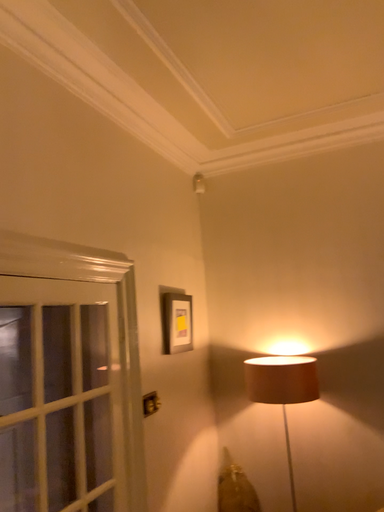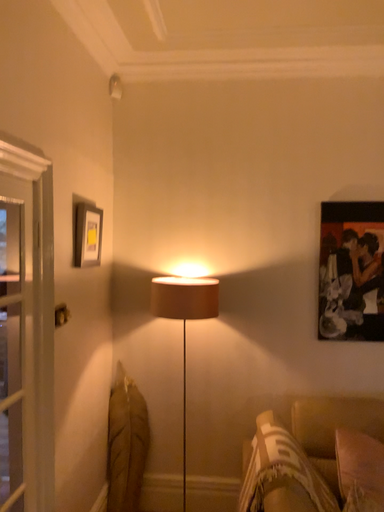
Question: How did the camera likely rotate when shooting the video?

Choices:
 (A) rotated upward
 (B) rotated downward

Answer: (B)